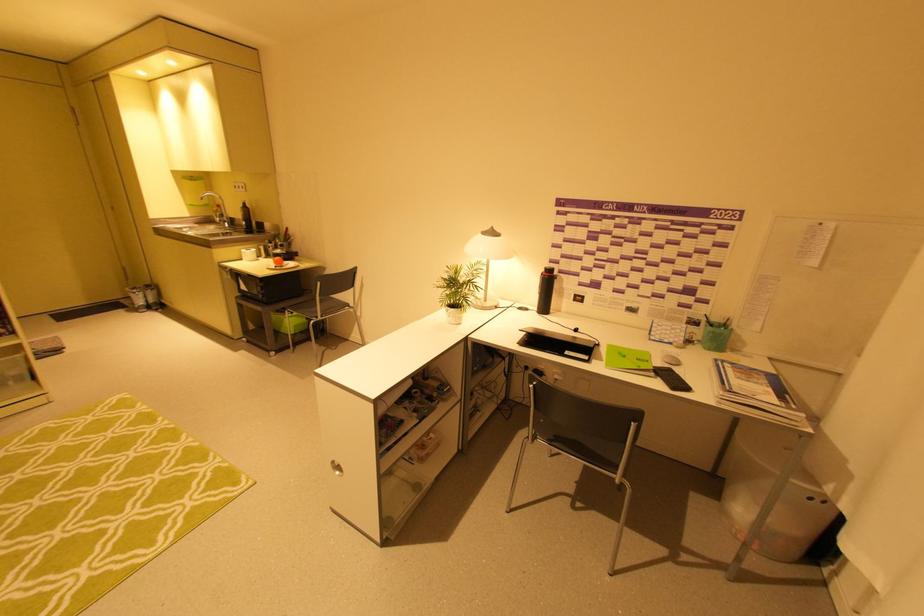
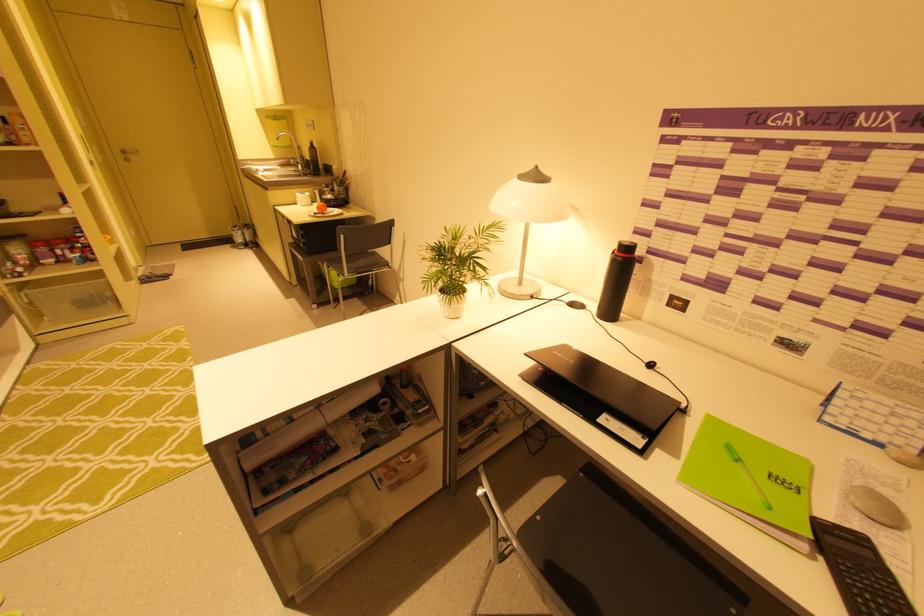
In the second image, find the point that corresponds to pixel 299 310 in the first image.

(334, 265)